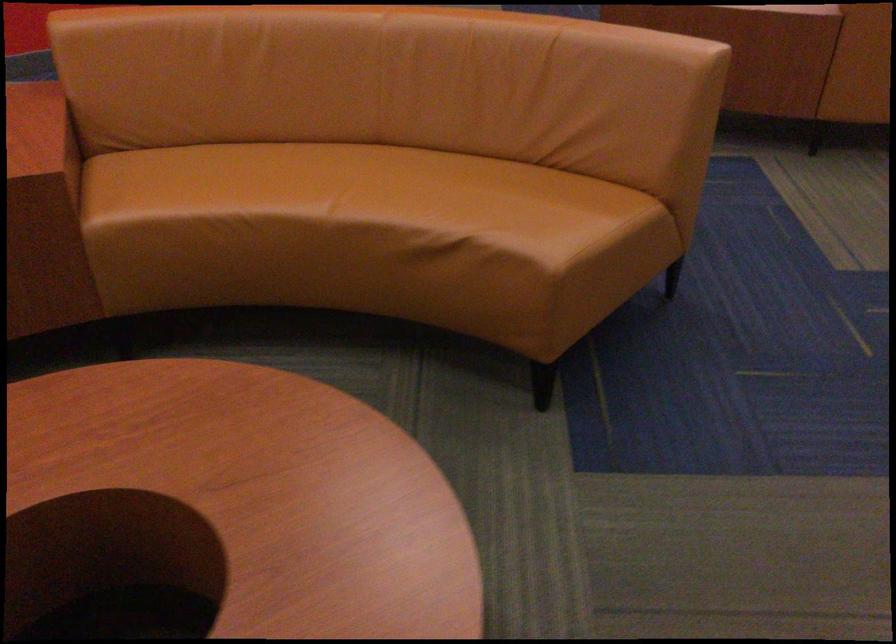
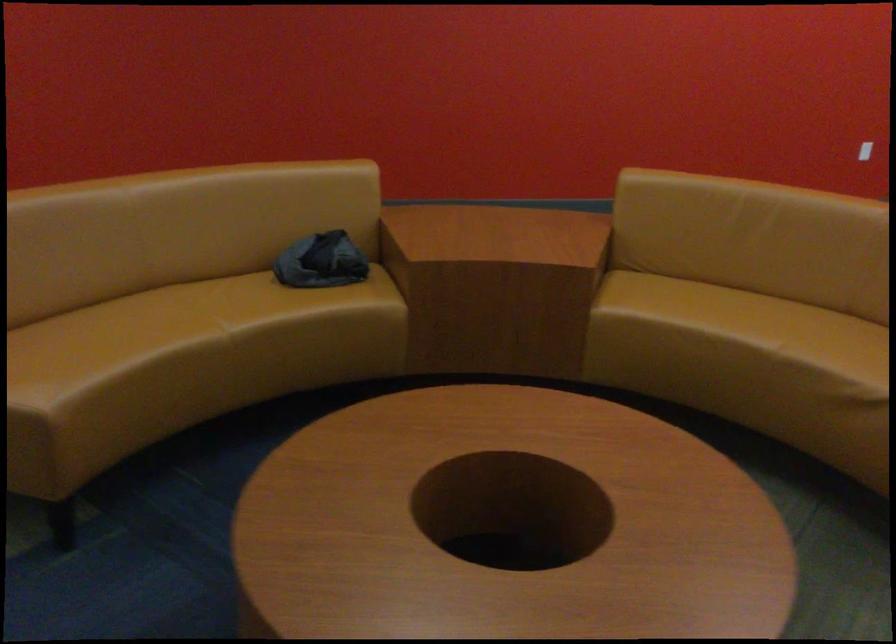
Question: The camera is either moving clockwise (left) or counter-clockwise (right) around the object. The first image is from the beginning of the video and the second image is from the end. Is the camera moving left or right when shooting the video?

Choices:
 (A) Left
 (B) Right

Answer: (B)